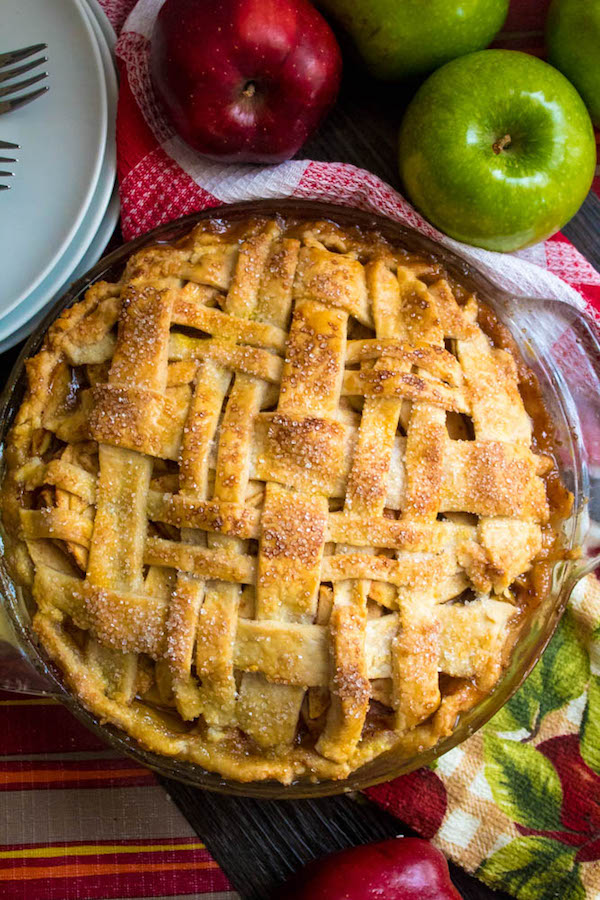
At what (x,y) coordinates should I click in order to perform the action: click on glass baking pie dish. Please return your answer as a coordinate pair (x, y). The width and height of the screenshot is (600, 900). Looking at the image, I should click on (537, 635), (331, 795), (202, 774), (25, 608).